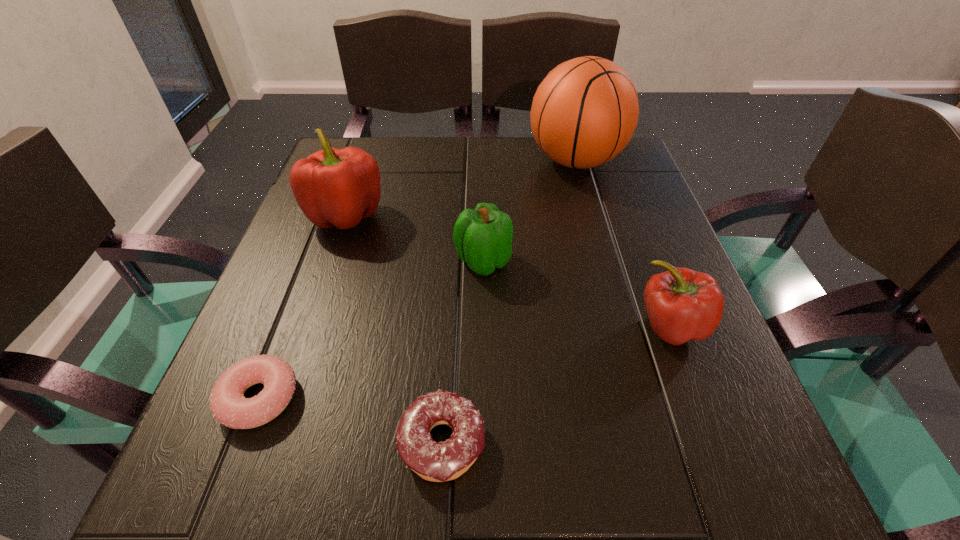
Image resolution: width=960 pixels, height=540 pixels. Identify the location of bell pepper at the left edge. (335, 187).

At what (x,y) coordinates should I click in order to perform the action: click on doughnut that is at the left edge. Please return your answer as a coordinate pair (x, y). Looking at the image, I should click on (229, 407).

I want to click on basketball situated at the right edge, so click(x=585, y=111).

The width and height of the screenshot is (960, 540). Find the location of `bell pepper positioned at the right edge`. bell pepper positioned at the right edge is located at coordinates (682, 304).

Where is `object that is at the far right corner`? The width and height of the screenshot is (960, 540). object that is at the far right corner is located at coordinates (585, 111).

This screenshot has height=540, width=960. I want to click on vacant area at the far edge, so click(512, 156).

Image resolution: width=960 pixels, height=540 pixels. Find the location of `vacant space at the near edge of the desktop`. vacant space at the near edge of the desktop is located at coordinates (582, 478).

The width and height of the screenshot is (960, 540). Find the location of `free space at the left edge of the desktop`. free space at the left edge of the desktop is located at coordinates (375, 228).

Locate an element on the screen. The image size is (960, 540). free space at the right edge of the desktop is located at coordinates (584, 195).

In order to click on free space at the far left corner of the desktop in this screenshot , I will do `click(382, 147)`.